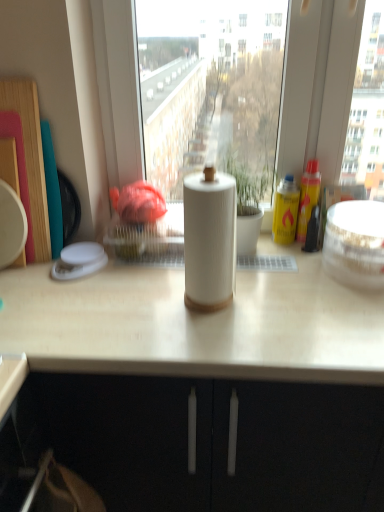
Find the location of a particular element. The height and width of the screenshot is (512, 384). free space in front of white matte paper towel at center is located at coordinates pos(208,343).